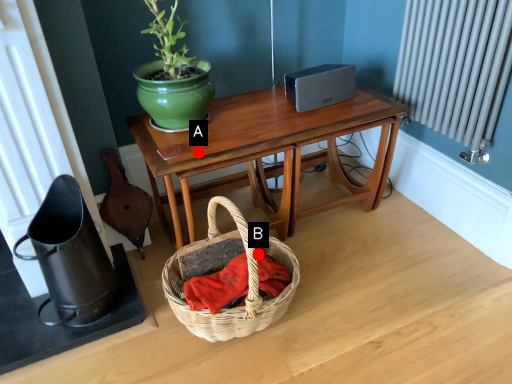
Question: Two points are circled on the image, labeled by A and B beside each circle. Which of the following is the farthest from the observer?

Choices:
 (A) A is further
 (B) B is further

Answer: (B)